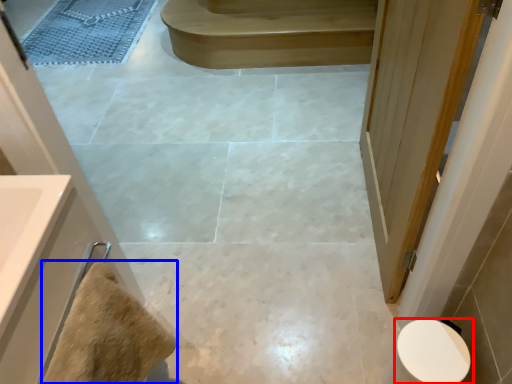
Question: Which of the following is the closest to the observer, toilet (highlighted by a red box) or material (highlighted by a blue box)?

Choices:
 (A) toilet
 (B) material

Answer: (B)